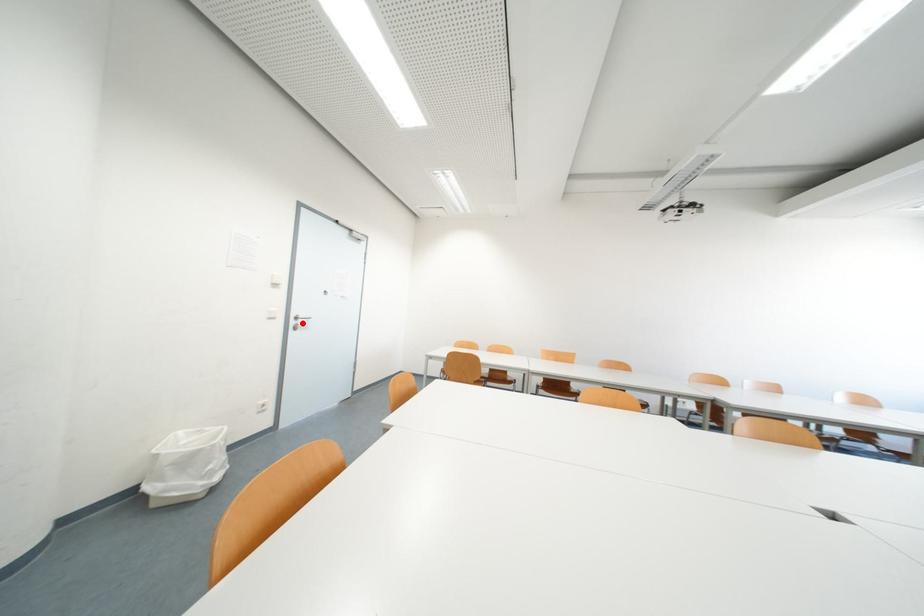
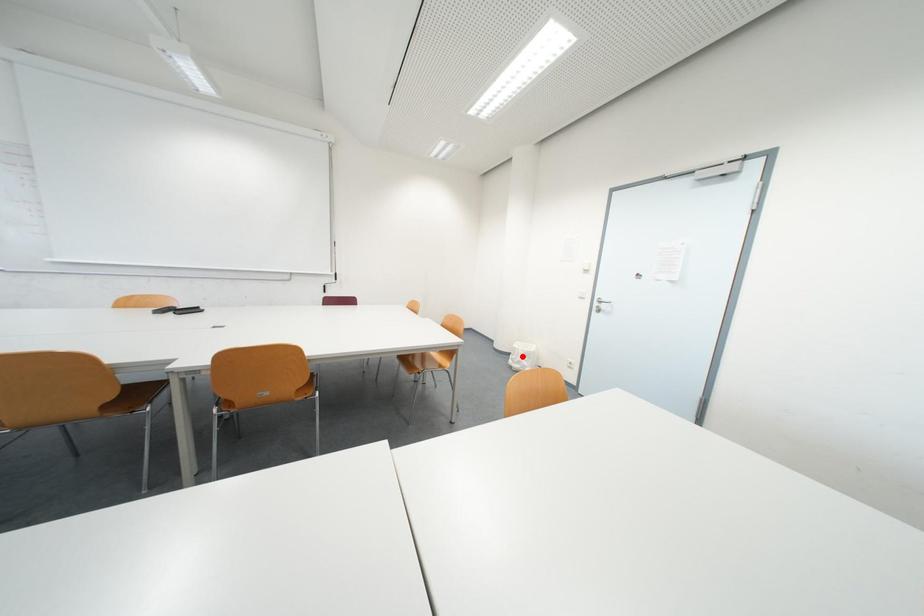
Based on the photo, I am providing you with two images of the same scene from different viewpoints. A red point is marked on the first image and another point is marked on the second image. Is the marked point in image1 the same physical position as the marked point in image2?

No